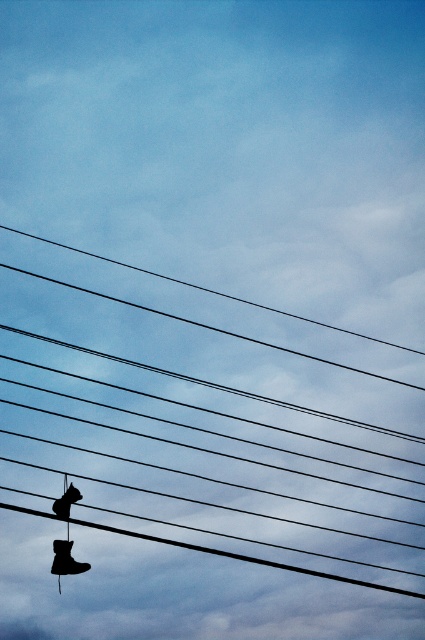
Question: Which object appears closest to the camera in this image?

Choices:
 (A) black wire at center
 (B) black rubber boot at lower left
 (C) matte black shoe at lower left

Answer: (A)

Question: Is black rubber boot at lower left below matte black shoe at lower left?

Choices:
 (A) no
 (B) yes

Answer: (B)

Question: Can you confirm if black wire at center is positioned above matte black shoe at lower left?

Choices:
 (A) yes
 (B) no

Answer: (A)

Question: Which point is closer to the camera?

Choices:
 (A) black wire at center
 (B) matte black shoe at lower left
 (C) black rubber boot at lower left

Answer: (A)

Question: Among these points, which one is farthest from the camera?

Choices:
 (A) (48, 525)
 (B) (57, 515)

Answer: (A)

Question: Does black wire at center have a greater width compared to matte black shoe at lower left?

Choices:
 (A) no
 (B) yes

Answer: (B)